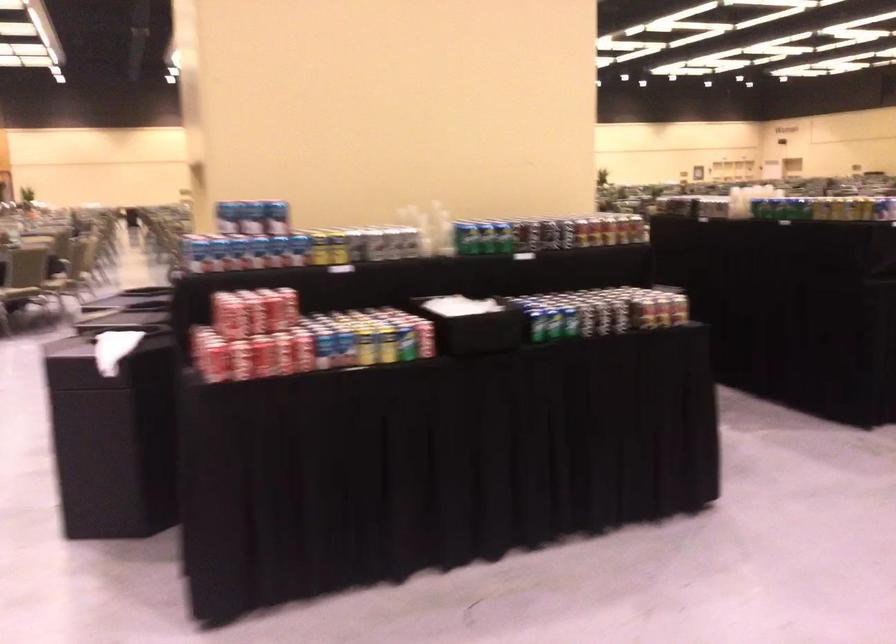
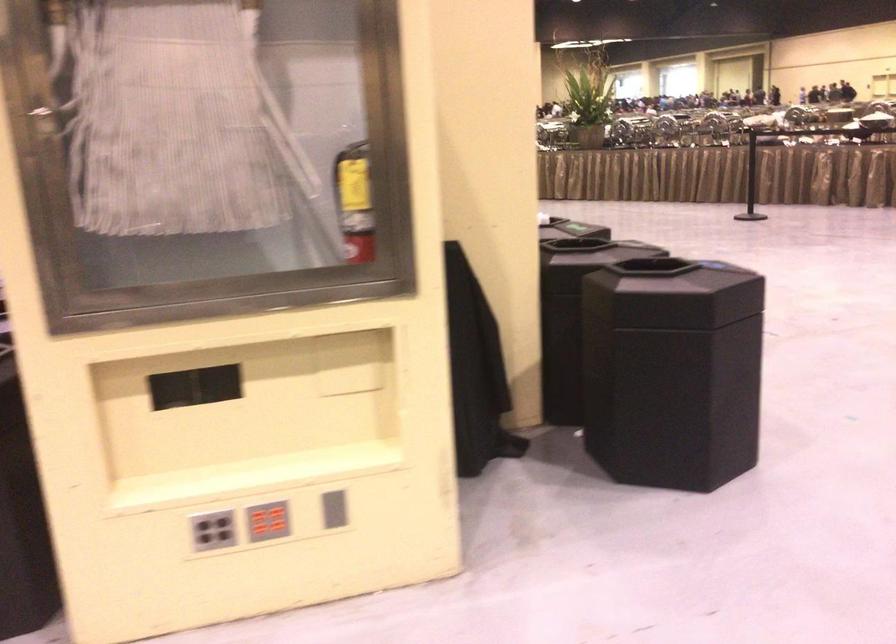
Question: I am providing you with two images of the same scene from different viewpoints. Please identify which objects are invisible in image2.

Choices:
 (A) blue soda can
 (B) hiking pole
 (C) grey button panel
 (D) grey vertical slot

Answer: (A)